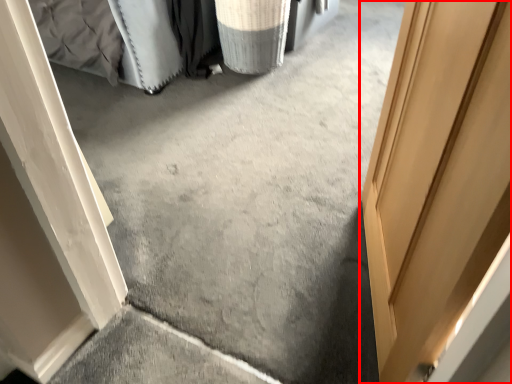
Question: In this image, where is door (annotated by the red box) located relative to laundry basket?

Choices:
 (A) right
 (B) left

Answer: (A)